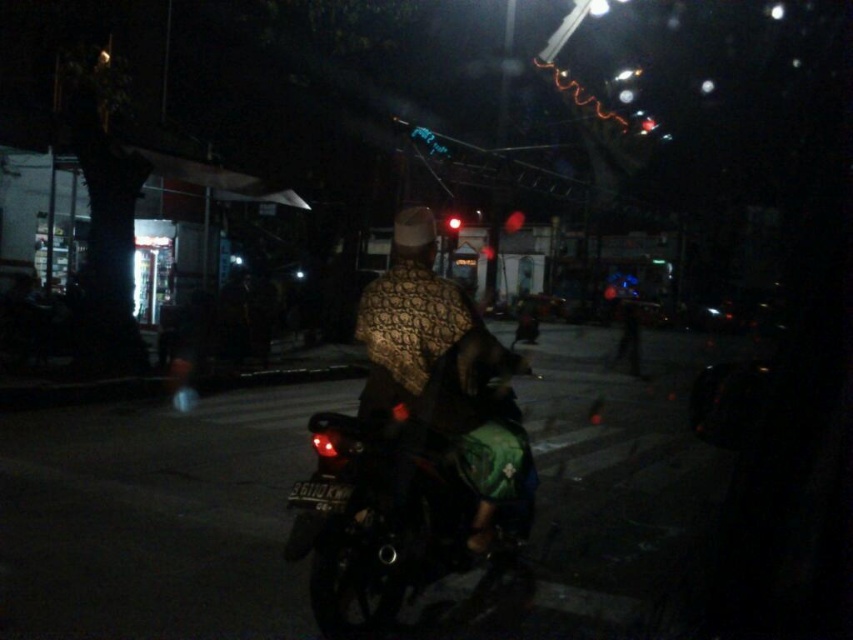
You are a pedestrian standing on the sidewalk and see the shiny black motorcycle at center and the red glass traffic light at center. Which object is closer to your left side?

The shiny black motorcycle at center is closer to your left side because it is positioned to the left of the red glass traffic light at center.

You are a delivery person who needs to park your shiny black motorcycle at center between two parked cars. The space between the cars is exactly the width of the red glass traffic light at center. Will your motorcycle fit in that space?

The shiny black motorcycle at center might be wider than red glass traffic light at center, so there is a possibility that the motorcycle will not fit in the space between the cars which is only as wide as the traffic light.